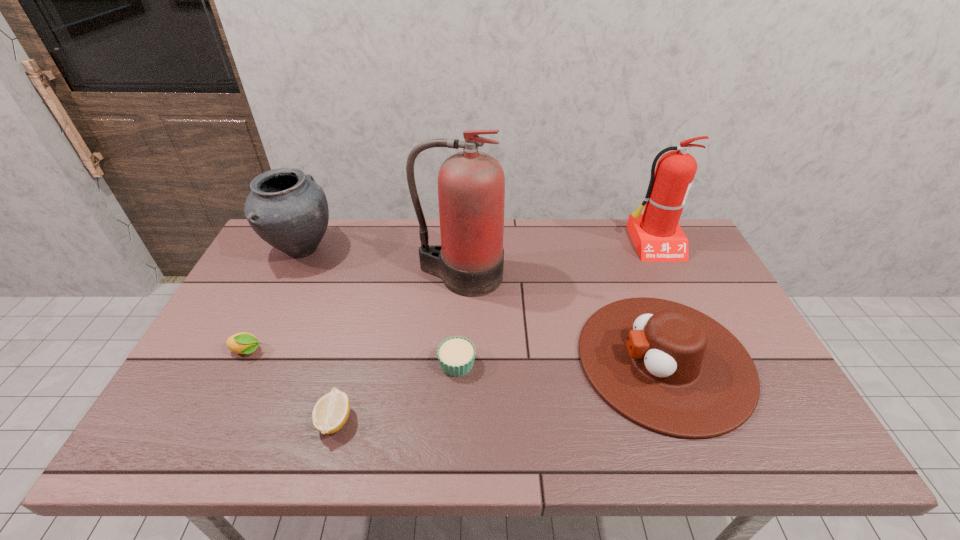
You are a GUI agent. You are given a task and a screenshot of the screen. Output one action in this format:
    pyautogui.click(x=<x>, y=<y>)
    Task: Click on the fifth object from right to left
    The width and height of the screenshot is (960, 540).
    Given the screenshot: What is the action you would take?
    pyautogui.click(x=330, y=413)

At what (x,y) coordinates should I click in order to perform the action: click on vacant space situated 0.050m at the nozzle of the taller fire extinguisher. Please return your answer as a coordinate pair (x, y). This screenshot has width=960, height=540. Looking at the image, I should click on (458, 309).

Locate an element on the screen. The width and height of the screenshot is (960, 540). vacant space located 0.300m on the front-facing side of the shorter fire extinguisher is located at coordinates (695, 332).

Identify the location of vacant space located on the right of the urn. Image resolution: width=960 pixels, height=540 pixels. [370, 249].

Image resolution: width=960 pixels, height=540 pixels. I want to click on free space located on the front-facing side of the fourth shortest object, so click(x=459, y=360).

Identify the location of vacant space located 0.390m on the front-facing side of the fourth shortest object. (428, 360).

At what (x,y) coordinates should I click in order to perform the action: click on vacant space located 0.080m on the front-facing side of the fourth shortest object. Please return your answer as a coordinate pair (x, y). Image resolution: width=960 pixels, height=540 pixels. Looking at the image, I should click on (548, 360).

At what (x,y) coordinates should I click in order to perform the action: click on free space located 0.050m with leaves positioned above the taller lemon. Please return your answer as a coordinate pair (x, y). Image resolution: width=960 pixels, height=540 pixels. Looking at the image, I should click on (284, 352).

Identify the location of vacant position located 0.210m on the right of the cupcake. Image resolution: width=960 pixels, height=540 pixels. (559, 363).

This screenshot has height=540, width=960. I want to click on free space located 0.250m on the left of the shorter lemon, so click(x=207, y=420).